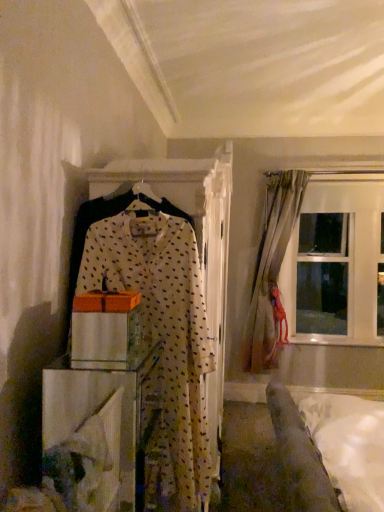
Question: Choose the correct answer: Is white sheer with polka dots at center inside transparent glass window at upper right or outside it?

Choices:
 (A) inside
 (B) outside

Answer: (B)

Question: Is white sheer with polka dots at center to the left or to the right of transparent glass window at upper right in the image?

Choices:
 (A) right
 (B) left

Answer: (B)

Question: Which of these objects is positioned closest to the light beige fabric curtain at right?

Choices:
 (A) transparent glass window at upper right
 (B) white sheer with polka dots at center
 (C) white soft bed at lower right
 (D) wooden box at center

Answer: (A)

Question: Which object is positioned farthest from the light beige fabric curtain at right?

Choices:
 (A) white sheer with polka dots at center
 (B) white soft bed at lower right
 (C) transparent glass window at upper right
 (D) wooden box at center

Answer: (A)